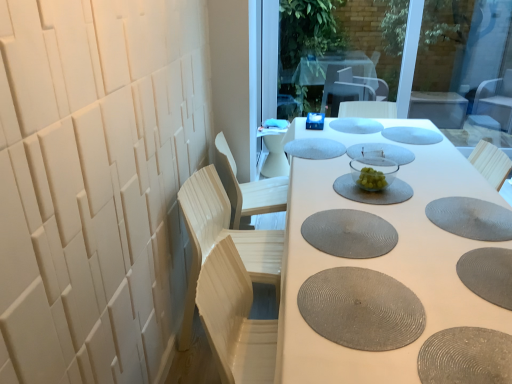
This screenshot has width=512, height=384. I want to click on vacant area situated below gray textured placemat at center, the ninth manhole cover when ordered from back to front (from a real-world perspective), so click(x=355, y=302).